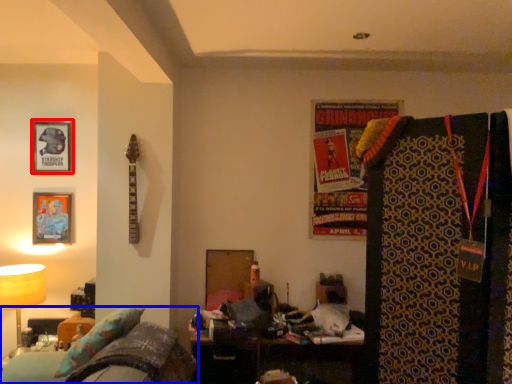
Question: Which of the following is the closest to the observer, picture frame (highlighted by a red box) or furniture (highlighted by a blue box)?

Choices:
 (A) picture frame
 (B) furniture

Answer: (B)